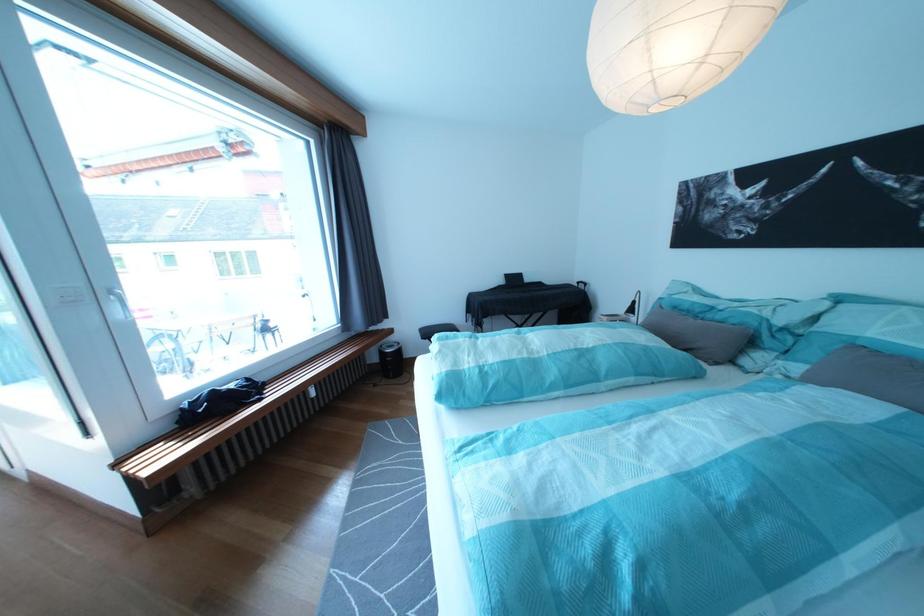
Where would you lift the small black lamp? Please return your answer as a coordinate pair (x, y).

(634, 307)